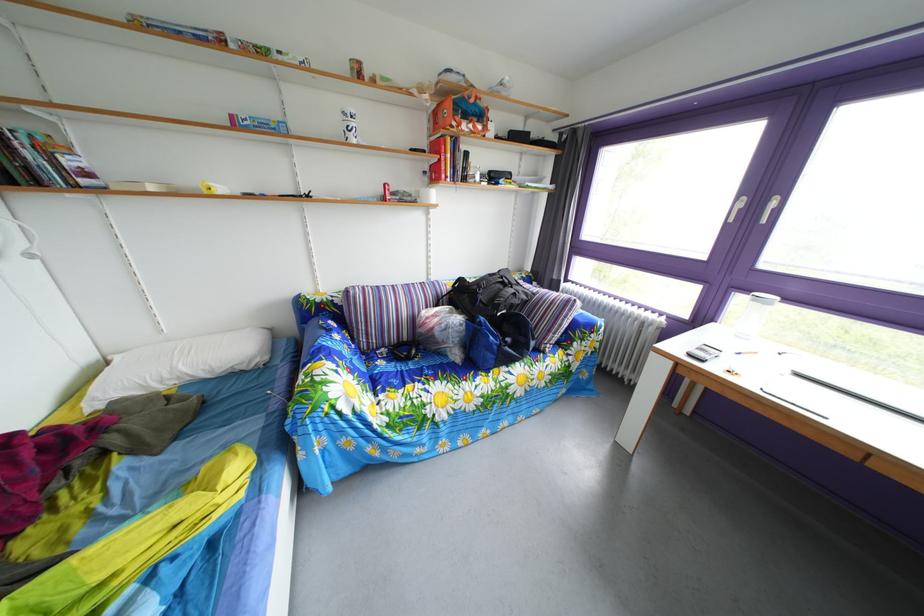
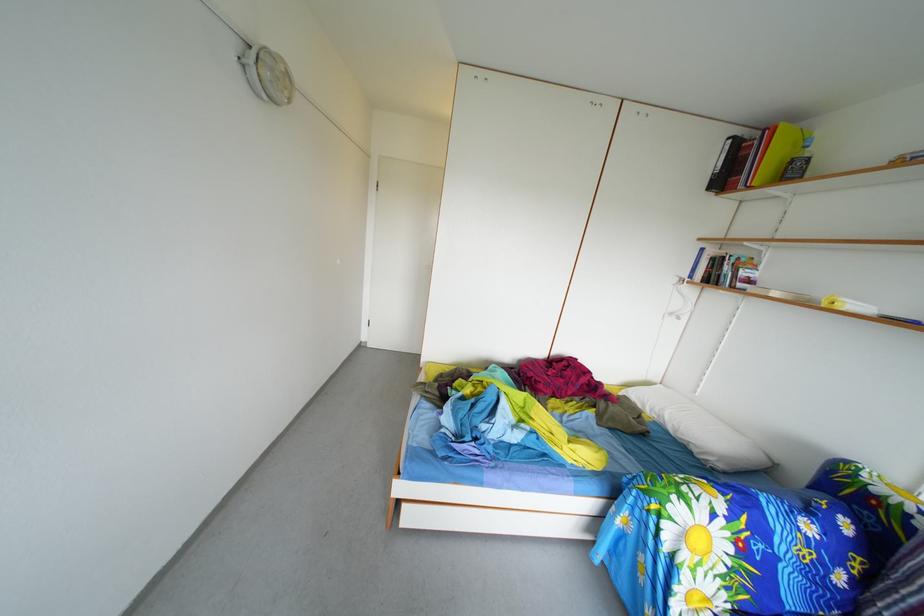
First-person continuous shooting, in which direction is the camera rotating?

The camera rotated toward left-down.